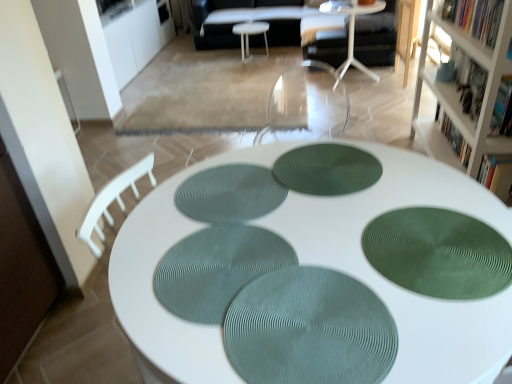
The width and height of the screenshot is (512, 384). What are the coordinates of `vacant space underneath green textured placemat at center, the 2th mat viewed from the right (from a real-world perspective)` in the screenshot? It's located at (333, 173).